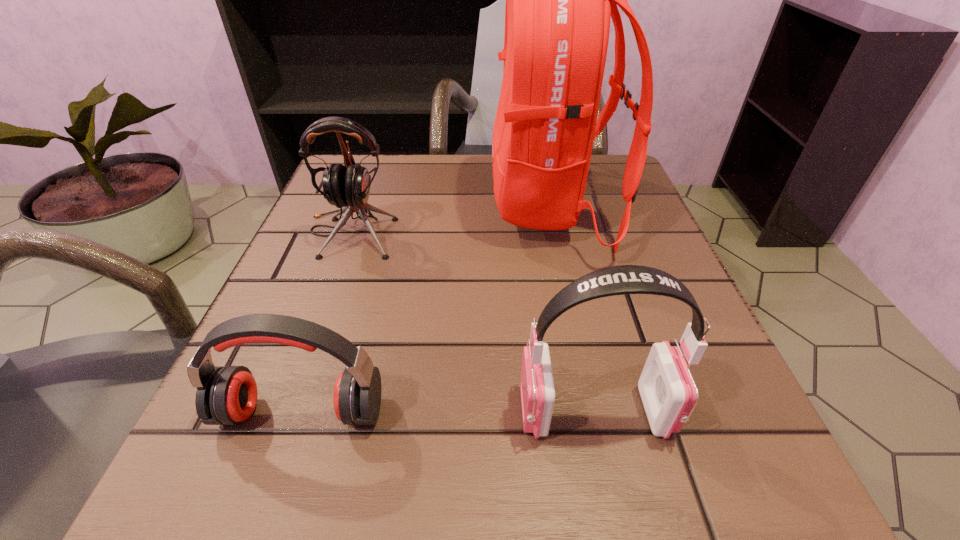
This screenshot has height=540, width=960. In order to click on free point that satisfies the following two spatial constraints: 1. on the main compartment of the backpack; 2. on the ear cups of the shortest object in this screenshot , I will do `click(595, 411)`.